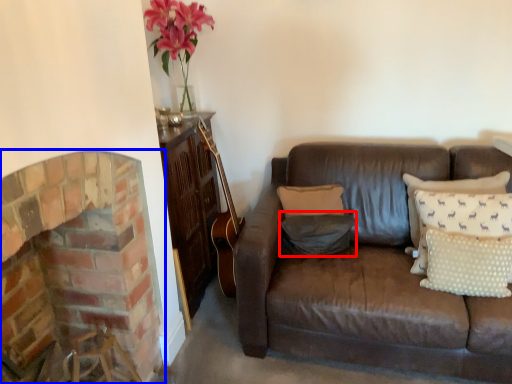
Question: Among these objects, which one is nearest to the camera, pillow (highlighted by a red box) or fireplace (highlighted by a blue box)?

Choices:
 (A) pillow
 (B) fireplace

Answer: (B)